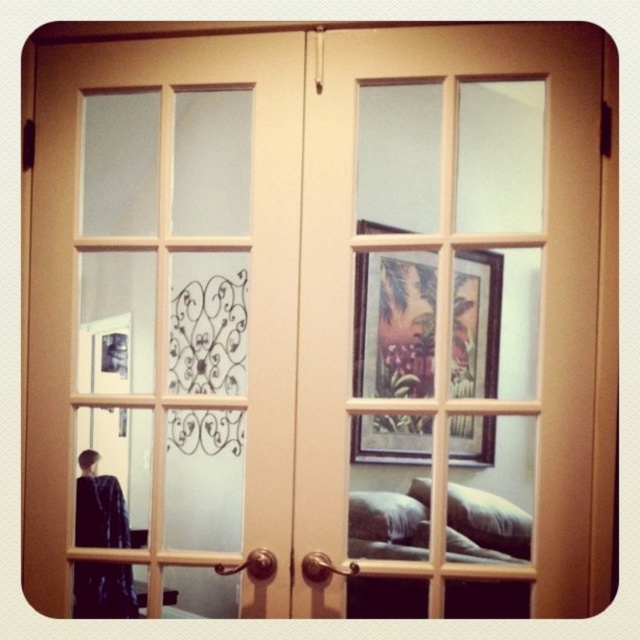
You are a delivery person trying to place a small package between the dark blue fabric at lower left and the soft beige pillow at lower right. Can you fit the package if it measures 26 inches in length?

The distance between the dark blue fabric at lower left and the soft beige pillow at lower right is 27.24 inches. Since the package is 26 inches long, it can fit within the available space.

You are standing in front of the double doors and want to sit on the closest pillow to you. Which pillow should you choose between the soft beige pillow at lower right and the white soft pillow at lower right?

The soft beige pillow at lower right is closer to the viewer, so you should choose the soft beige pillow at lower right.

You are a delivery person trying to place a package on the floor between the matte wood door at center and the white soft pillow at lower right. The package is 20 inches long. Will it fit in the space between them?

The space between the matte wood door at center and the white soft pillow at lower right is 20.52 inches. Since the package is 20 inches long, it will fit in the space between them.